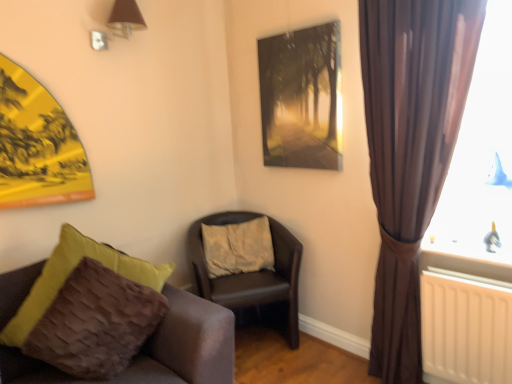
Question: Considering the relative sizes of leather-like brown chair at center, arranged as the first chair when viewed from the back, and brown satin curtain at right in the image provided, is leather-like brown chair at center, arranged as the first chair when viewed from the back, wider than brown satin curtain at right?

Choices:
 (A) yes
 (B) no

Answer: (A)

Question: Is leather-like brown chair at center, arranged as the first chair when viewed from the back, bigger than brown satin curtain at right?

Choices:
 (A) no
 (B) yes

Answer: (B)

Question: Is brown satin curtain at right completely or partially inside leather-like brown chair at center, which is the second chair from front to back?

Choices:
 (A) no
 (B) yes

Answer: (A)

Question: Can you confirm if leather-like brown chair at center, which is the second chair from front to back, is positioned to the left of brown satin curtain at right?

Choices:
 (A) no
 (B) yes

Answer: (B)

Question: Is leather-like brown chair at center, which is the second chair from front to back, not close to brown satin curtain at right?

Choices:
 (A) yes
 (B) no

Answer: (B)

Question: Is leather-like brown chair at center, which is the second chair from front to back, outside brown satin curtain at right?

Choices:
 (A) yes
 (B) no

Answer: (A)

Question: Is the position of brown satin curtain at right more distant than that of beige fabric pillow at center?

Choices:
 (A) no
 (B) yes

Answer: (A)

Question: Considering the relative sizes of brown satin curtain at right and beige fabric pillow at center in the image provided, is brown satin curtain at right wider than beige fabric pillow at center?

Choices:
 (A) yes
 (B) no

Answer: (B)

Question: From a real-world perspective, is brown satin curtain at right under beige fabric pillow at center?

Choices:
 (A) no
 (B) yes

Answer: (A)

Question: Would you say brown satin curtain at right is a long distance from beige fabric pillow at center?

Choices:
 (A) no
 (B) yes

Answer: (A)

Question: Is brown satin curtain at right looking in the opposite direction of beige fabric pillow at center?

Choices:
 (A) yes
 (B) no

Answer: (B)

Question: Considering the relative sizes of brown satin curtain at right and beige fabric pillow at center in the image provided, is brown satin curtain at right bigger than beige fabric pillow at center?

Choices:
 (A) yes
 (B) no

Answer: (A)

Question: Does metallic silver picture frame at upper center have a larger size compared to leather-like brown chair at center, arranged as the first chair when viewed from the back?

Choices:
 (A) no
 (B) yes

Answer: (A)